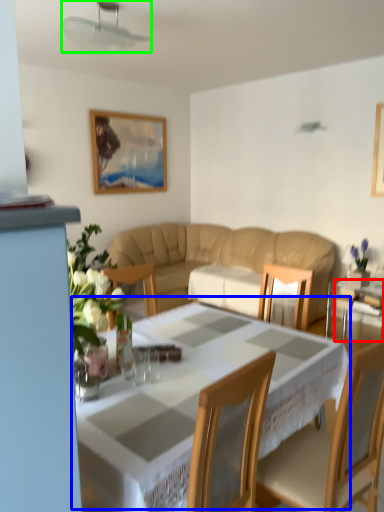
Question: Which object is positioned closest to glass table (highlighted by a red box)? Select from table (highlighted by a blue box) and fan (highlighted by a green box).

Choices:
 (A) table
 (B) fan

Answer: (A)